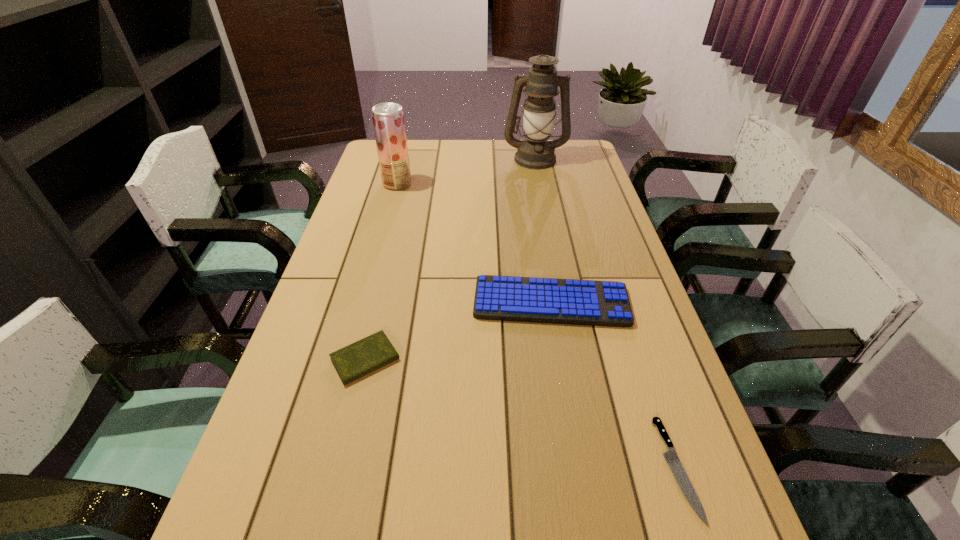
In order to click on steak knife at the right edge in this screenshot , I will do `click(671, 457)`.

This screenshot has width=960, height=540. Find the location of `object positioned at the far right corner`. object positioned at the far right corner is located at coordinates (535, 152).

At what (x,y) coordinates should I click in order to perform the action: click on vacant space at the far edge of the desktop. Please return your answer as a coordinate pair (x, y). Looking at the image, I should click on (468, 167).

This screenshot has width=960, height=540. I want to click on vacant space at the left edge of the desktop, so click(x=376, y=284).

Find the location of a particular element. vacant space at the right edge is located at coordinates (575, 193).

Find the location of a particular element. unoccupied area between the diary and the fourth shortest object is located at coordinates (381, 271).

The width and height of the screenshot is (960, 540). Identify the location of free space between the fourth nearest object and the farthest object. (466, 171).

Identify the location of free space that is in between the farthest object and the fourth nearest object. (466, 171).

At what (x,y) coordinates should I click in order to perform the action: click on free space that is in between the third shortest object and the tallest object. Please return your answer as a coordinate pair (x, y). Image resolution: width=960 pixels, height=540 pixels. Looking at the image, I should click on pos(543,231).

This screenshot has height=540, width=960. In order to click on free spot between the oil lamp and the third tallest object in this screenshot , I will do `click(543, 231)`.